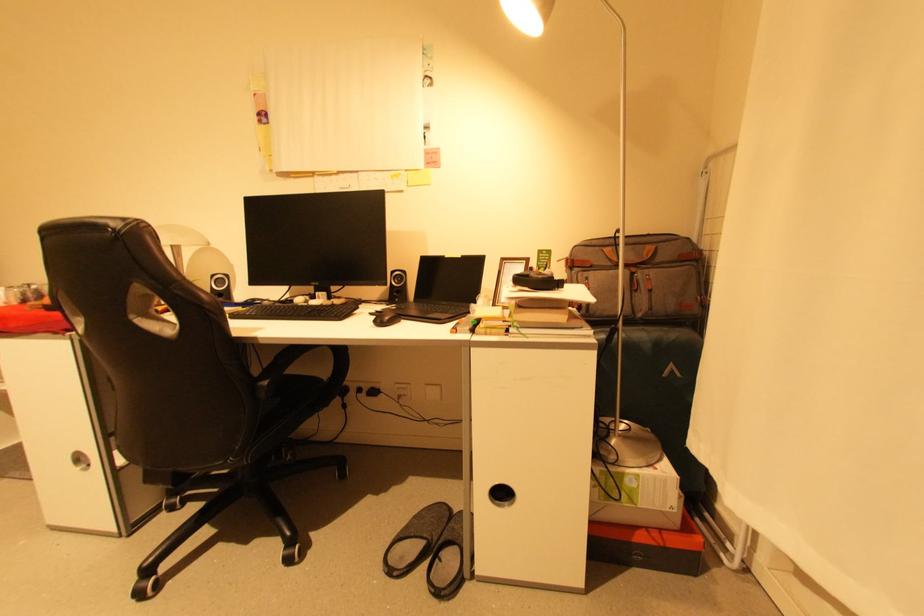
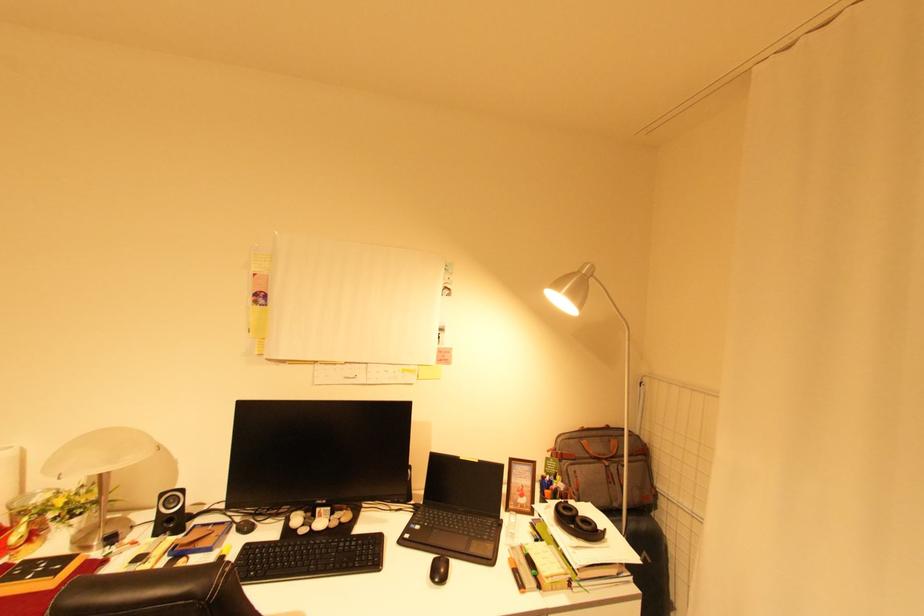
In the second image, find the point that corresponds to pixel 468 257 in the first image.

(484, 462)